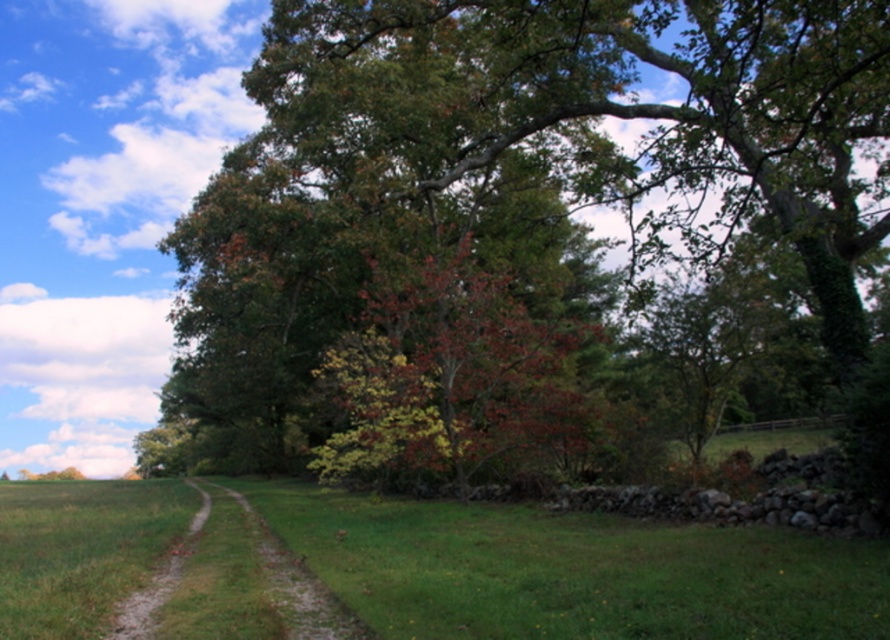
Which is more to the right, green leafy tree at center or green grassy trail at center?

green leafy tree at center

Who is higher up, green leafy tree at center or green grassy trail at center?

green leafy tree at center is above.

Between point (674, 317) and point (297, 563), which one is positioned behind?

The point (674, 317) is behind.

Image resolution: width=890 pixels, height=640 pixels. I want to click on green leafy tree at center, so click(x=534, y=195).